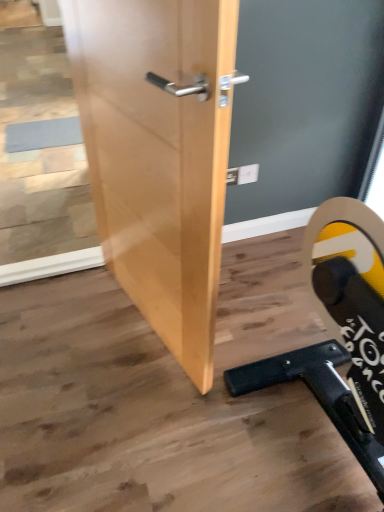
In order to click on vacant area that lies to the right of natural wood door at center in this screenshot , I will do [x=266, y=338].